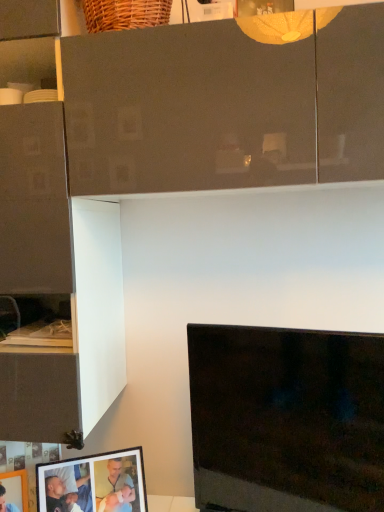
What do you see at coordinates (21, 485) in the screenshot? This screenshot has height=512, width=384. I see `matte black picture frame at lower left, placed as the 1th picture frame when sorted from left to right` at bounding box center [21, 485].

Find the location of `black glossy tv at lower right`. black glossy tv at lower right is located at coordinates (286, 419).

This screenshot has height=512, width=384. Find the location of `matte black picture frame at lower left, placed as the second picture frame when sorted from right to left`. matte black picture frame at lower left, placed as the second picture frame when sorted from right to left is located at coordinates 21,485.

Could you measure the distance between matte black picture frame at lower left, marked as the 2th picture frame in a left-to-right arrangement, and black glossy tv at lower right?

matte black picture frame at lower left, marked as the 2th picture frame in a left-to-right arrangement, and black glossy tv at lower right are 16.44 inches apart from each other.

Based on the photo, based on their sizes in the image, would you say matte black picture frame at lower left, marked as the 2th picture frame in a left-to-right arrangement, is bigger or smaller than black glossy tv at lower right?

matte black picture frame at lower left, marked as the 2th picture frame in a left-to-right arrangement, is smaller than black glossy tv at lower right.

Between matte black picture frame at lower left, arranged as the 1th picture frame when viewed from the right, and black glossy tv at lower right, which one is positioned behind?

matte black picture frame at lower left, arranged as the 1th picture frame when viewed from the right, is behind.

Would you say black glossy tv at lower right is part of matte black picture frame at lower left, arranged as the 1th picture frame when viewed from the right,'s contents?

No, black glossy tv at lower right is not surrounded by matte black picture frame at lower left, arranged as the 1th picture frame when viewed from the right.

From the image's perspective, does black glossy tv at lower right appear higher than matte black picture frame at lower left, arranged as the 1th picture frame when viewed from the right?

Yes.

Does black glossy tv at lower right appear on the left side of matte black picture frame at lower left, arranged as the 1th picture frame when viewed from the right?

No, black glossy tv at lower right is not to the left of matte black picture frame at lower left, arranged as the 1th picture frame when viewed from the right.

From a real-world perspective, is black glossy tv at lower right located higher than matte black picture frame at lower left, arranged as the 1th picture frame when viewed from the right?

Yes, from a real-world perspective, black glossy tv at lower right is on top of matte black picture frame at lower left, arranged as the 1th picture frame when viewed from the right.

Relative to matte black picture frame at lower left, marked as the 2th picture frame in a left-to-right arrangement, is matte black picture frame at lower left, placed as the second picture frame when sorted from right to left, in front or behind?

Clearly, matte black picture frame at lower left, placed as the second picture frame when sorted from right to left, is in front of matte black picture frame at lower left, marked as the 2th picture frame in a left-to-right arrangement.

What's the angular difference between matte black picture frame at lower left, placed as the second picture frame when sorted from right to left, and matte black picture frame at lower left, marked as the 2th picture frame in a left-to-right arrangement,'s facing directions?

They differ by 3.55 degrees in their facing directions.

Is matte black picture frame at lower left, placed as the 1th picture frame when sorted from left to right, turned away from matte black picture frame at lower left, marked as the 2th picture frame in a left-to-right arrangement?

That's not correct — matte black picture frame at lower left, placed as the 1th picture frame when sorted from left to right, is not looking away from matte black picture frame at lower left, marked as the 2th picture frame in a left-to-right arrangement.

Is point (195, 496) less distant than point (11, 471)?

Yes, it is.

How much distance is there between black glossy tv at lower right and matte black picture frame at lower left, placed as the 1th picture frame when sorted from left to right?

29.34 inches.

Which is correct: black glossy tv at lower right is inside matte black picture frame at lower left, placed as the 1th picture frame when sorted from left to right, or outside of it?

black glossy tv at lower right is not enclosed by matte black picture frame at lower left, placed as the 1th picture frame when sorted from left to right.

Locate an element on the screen. television lying above the matte black picture frame at lower left, placed as the 1th picture frame when sorted from left to right (from the image's perspective) is located at coordinates (286, 419).

From the image's perspective, relative to black glossy tv at lower right, is matte black picture frame at lower left, placed as the 1th picture frame when sorted from left to right, above or below?

matte black picture frame at lower left, placed as the 1th picture frame when sorted from left to right, is below black glossy tv at lower right.

Is matte black picture frame at lower left, placed as the second picture frame when sorted from right to left, oriented away from black glossy tv at lower right?

That's not correct — matte black picture frame at lower left, placed as the second picture frame when sorted from right to left, is not looking away from black glossy tv at lower right.

Which object is positioned more to the left, matte black picture frame at lower left, placed as the second picture frame when sorted from right to left, or black glossy tv at lower right?

matte black picture frame at lower left, placed as the second picture frame when sorted from right to left.

From the picture: Is matte black picture frame at lower left, marked as the 2th picture frame in a left-to-right arrangement, beside matte black picture frame at lower left, placed as the 1th picture frame when sorted from left to right?

matte black picture frame at lower left, marked as the 2th picture frame in a left-to-right arrangement, is not next to matte black picture frame at lower left, placed as the 1th picture frame when sorted from left to right, and they're not touching.

Is matte black picture frame at lower left, arranged as the 1th picture frame when viewed from the right, bigger than matte black picture frame at lower left, placed as the 1th picture frame when sorted from left to right?

Yes, matte black picture frame at lower left, arranged as the 1th picture frame when viewed from the right, is bigger than matte black picture frame at lower left, placed as the 1th picture frame when sorted from left to right.

Looking at this image, how different are the orientations of matte black picture frame at lower left, marked as the 2th picture frame in a left-to-right arrangement, and matte black picture frame at lower left, placed as the second picture frame when sorted from right to left, in degrees?

They differ by 3.55 degrees in their facing directions.

This screenshot has height=512, width=384. In order to click on television lying on the right of matte black picture frame at lower left, arranged as the 1th picture frame when viewed from the right in this screenshot , I will do `click(286, 419)`.

In order to click on picture frame that is the 1st one when counting downward from the black glossy tv at lower right (from the image's perspective) in this screenshot , I will do `click(94, 483)`.

When comparing their distances from matte black picture frame at lower left, arranged as the 1th picture frame when viewed from the right, does black glossy tv at lower right or matte black picture frame at lower left, placed as the second picture frame when sorted from right to left, seem further?

Among the two, black glossy tv at lower right is located further to matte black picture frame at lower left, arranged as the 1th picture frame when viewed from the right.

When comparing their distances from matte black picture frame at lower left, arranged as the 1th picture frame when viewed from the right, does matte black picture frame at lower left, placed as the second picture frame when sorted from right to left, or black glossy tv at lower right seem closer?

Among the two, matte black picture frame at lower left, placed as the second picture frame when sorted from right to left, is located nearer to matte black picture frame at lower left, arranged as the 1th picture frame when viewed from the right.

When comparing their distances from matte black picture frame at lower left, placed as the 1th picture frame when sorted from left to right, does black glossy tv at lower right or matte black picture frame at lower left, arranged as the 1th picture frame when viewed from the right, seem further?

black glossy tv at lower right lies further to matte black picture frame at lower left, placed as the 1th picture frame when sorted from left to right, than the other object.

From the image, which object appears to be nearer to black glossy tv at lower right, matte black picture frame at lower left, placed as the 1th picture frame when sorted from left to right, or matte black picture frame at lower left, marked as the 2th picture frame in a left-to-right arrangement?

The object closer to black glossy tv at lower right is matte black picture frame at lower left, marked as the 2th picture frame in a left-to-right arrangement.

Looking at the image, which one is located further to black glossy tv at lower right, matte black picture frame at lower left, marked as the 2th picture frame in a left-to-right arrangement, or matte black picture frame at lower left, placed as the 1th picture frame when sorted from left to right?

matte black picture frame at lower left, placed as the 1th picture frame when sorted from left to right.

When comparing their distances from matte black picture frame at lower left, placed as the 1th picture frame when sorted from left to right, does matte black picture frame at lower left, marked as the 2th picture frame in a left-to-right arrangement, or black glossy tv at lower right seem further?

black glossy tv at lower right is further to matte black picture frame at lower left, placed as the 1th picture frame when sorted from left to right.

Identify the location of picture frame between matte black picture frame at lower left, placed as the second picture frame when sorted from right to left, and black glossy tv at lower right. The height and width of the screenshot is (512, 384). (94, 483).